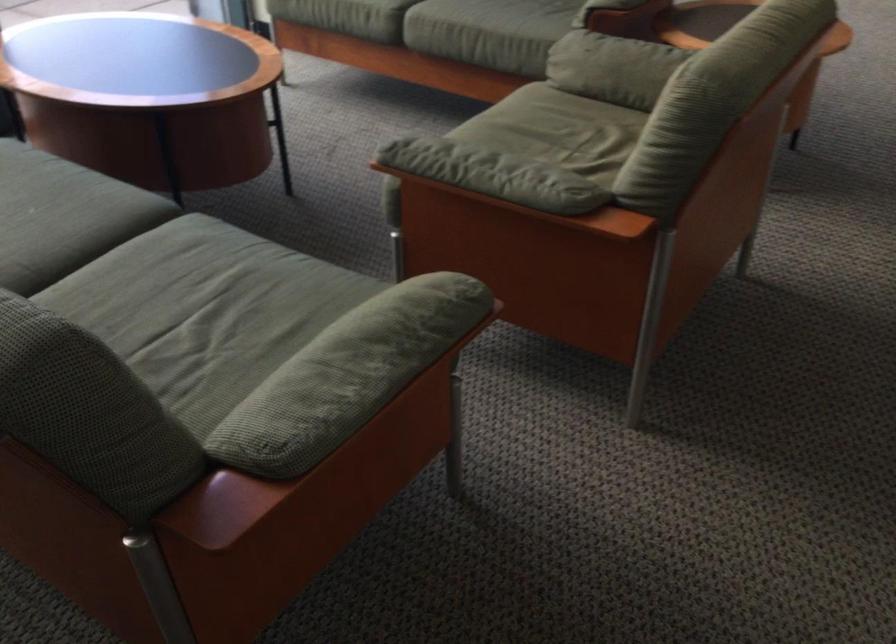
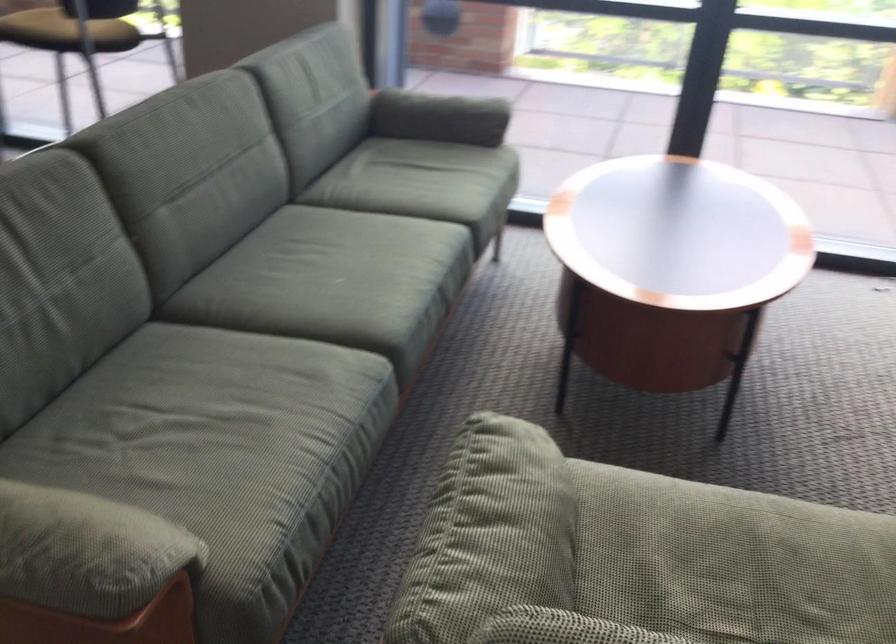
The point at (495, 160) is marked in the first image. Where is the corresponding point in the second image?

(500, 527)